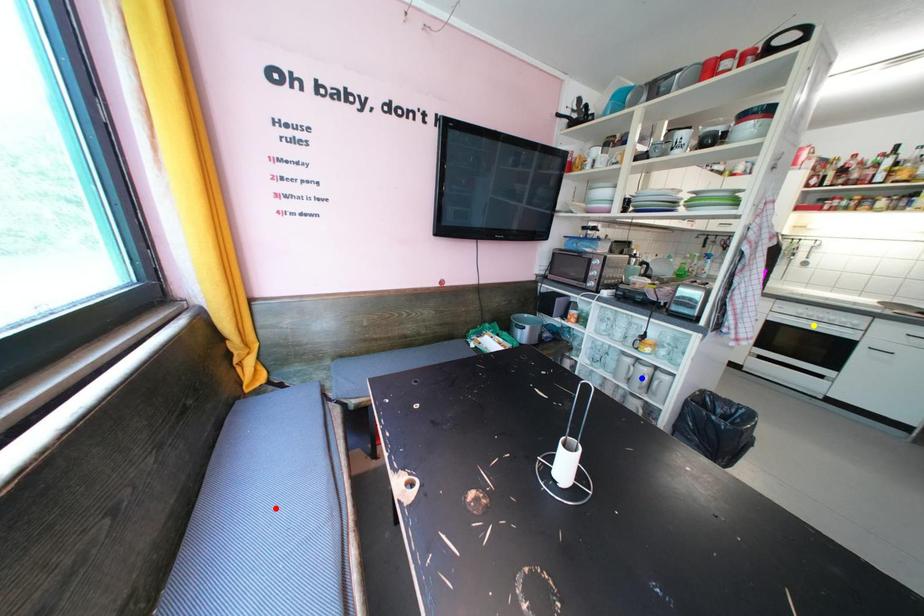
Order these from nearest to farthest:
- red point
- yellow point
- blue point

yellow point < blue point < red point